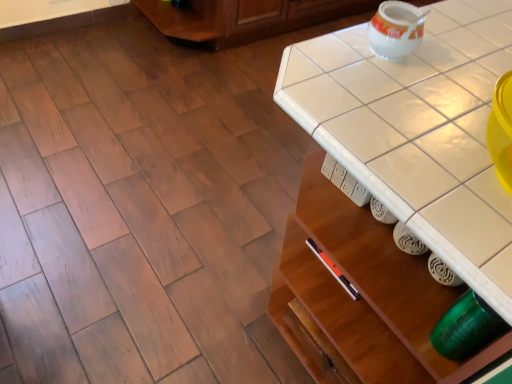
What do you see at coordinates (419, 131) in the screenshot? I see `white tile counter top at center` at bounding box center [419, 131].

You are a GUI agent. You are given a task and a screenshot of the screen. Output one action in this format:
    pyautogui.click(x=<x>, y=<y>)
    Task: Click on the white tile counter top at center
    The height and width of the screenshot is (384, 512).
    Given the screenshot: What is the action you would take?
    pyautogui.click(x=419, y=131)

What is the approximate width of white tile counter top at center?

white tile counter top at center is 23.83 inches in width.

Describe the element at coordinates (396, 30) in the screenshot. I see `white glossy tea pot at upper right` at that location.

What is the approximate height of white glossy tea pot at upper right?

white glossy tea pot at upper right is 3.69 inches tall.

Find the location of a particular element. white glossy tea pot at upper right is located at coordinates (396, 30).

I want to click on white tile counter top at center, so click(x=419, y=131).

From the picture: Is white tile counter top at center at the left side of white glossy tea pot at upper right?

Result: In fact, white tile counter top at center is to the right of white glossy tea pot at upper right.

Considering the relative positions of white tile counter top at center and white glossy tea pot at upper right in the image provided, is white tile counter top at center in front of white glossy tea pot at upper right?

Yes.

Does point (361, 180) appear closer or farther from the camera than point (396, 12)?

Clearly, point (361, 180) is closer to the camera than point (396, 12).

From the image's perspective, is white tile counter top at center above or below white glossy tea pot at upper right?

white tile counter top at center is below white glossy tea pot at upper right.

From a real-world perspective, is white tile counter top at center on white glossy tea pot at upper right?

No, from a real-world perspective, white tile counter top at center is not on top of white glossy tea pot at upper right.

In terms of width, does white tile counter top at center look wider or thinner when compared to white glossy tea pot at upper right?

Clearly, white tile counter top at center has more width compared to white glossy tea pot at upper right.

From their relative heights in the image, would you say white tile counter top at center is taller or shorter than white glossy tea pot at upper right?

In the image, white tile counter top at center appears to be shorter than white glossy tea pot at upper right.

Which of these two, white tile counter top at center or white glossy tea pot at upper right, is bigger?

white tile counter top at center is bigger.

Choose the correct answer: Is white tile counter top at center inside white glossy tea pot at upper right or outside it?

white tile counter top at center is not inside white glossy tea pot at upper right, it's outside.

Are white tile counter top at center and white glossy tea pot at upper right far apart?

No, white tile counter top at center is not far away from white glossy tea pot at upper right.

Could you tell me if white tile counter top at center is facing white glossy tea pot at upper right?

No, white tile counter top at center does not turn towards white glossy tea pot at upper right.

How different are the orientations of white tile counter top at center and white glossy tea pot at upper right in degrees?

The facing directions of white tile counter top at center and white glossy tea pot at upper right are 0.00239 degrees apart.

How much distance is there between white tile counter top at center and white glossy tea pot at upper right?

The distance of white tile counter top at center from white glossy tea pot at upper right is 5.78 inches.

Identify the location of tea pot that is above the white tile counter top at center (from the image's perspective). The image size is (512, 384). (396, 30).

Between white glossy tea pot at upper right and white tile counter top at center, which one appears on the right side from the viewer's perspective?

Positioned to the right is white tile counter top at center.

Is white glossy tea pot at upper right further to camera compared to white tile counter top at center?

Yes, it is.

Does point (387, 44) come behind point (391, 205)?

Yes.

From the image's perspective, which object appears higher, white glossy tea pot at upper right or white tile counter top at center?

white glossy tea pot at upper right is shown above in the image.

From a real-world perspective, is white glossy tea pot at upper right physically located above or below white tile counter top at center?

white glossy tea pot at upper right is above white tile counter top at center.

Does white glossy tea pot at upper right have a greater width compared to white tile counter top at center?

No, white glossy tea pot at upper right is not wider than white tile counter top at center.

Is white glossy tea pot at upper right taller than white tile counter top at center?

Correct, white glossy tea pot at upper right is much taller as white tile counter top at center.

Can you confirm if white glossy tea pot at upper right is bigger than white tile counter top at center?

Incorrect, white glossy tea pot at upper right is not larger than white tile counter top at center.

Is white glossy tea pot at upper right spatially inside white tile counter top at center, or outside of it?

white glossy tea pot at upper right cannot be found inside white tile counter top at center.

Does white glossy tea pot at upper right touch white tile counter top at center?

They are not placed beside each other.

Is white glossy tea pot at upper right oriented towards white tile counter top at center?

No, white glossy tea pot at upper right does not turn towards white tile counter top at center.

The width and height of the screenshot is (512, 384). Find the location of `tea pot on the left of white tile counter top at center`. tea pot on the left of white tile counter top at center is located at coordinates (396, 30).

Where is `tea pot located above the white tile counter top at center (from the image's perspective)`? The width and height of the screenshot is (512, 384). tea pot located above the white tile counter top at center (from the image's perspective) is located at coordinates (396, 30).

The height and width of the screenshot is (384, 512). I want to click on counter top in front of the white glossy tea pot at upper right, so click(x=419, y=131).